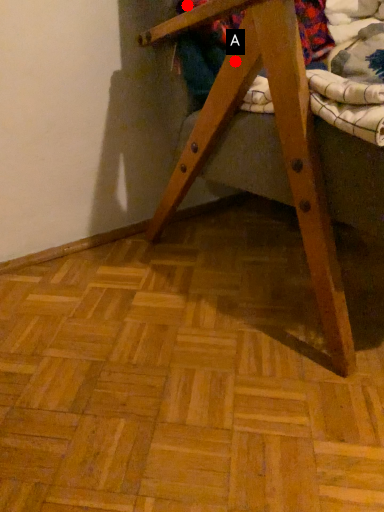
Question: Two points are circled on the image, labeled by A and B beside each circle. Which point appears farthest from the camera in this image?

Choices:
 (A) A is further
 (B) B is further

Answer: (B)